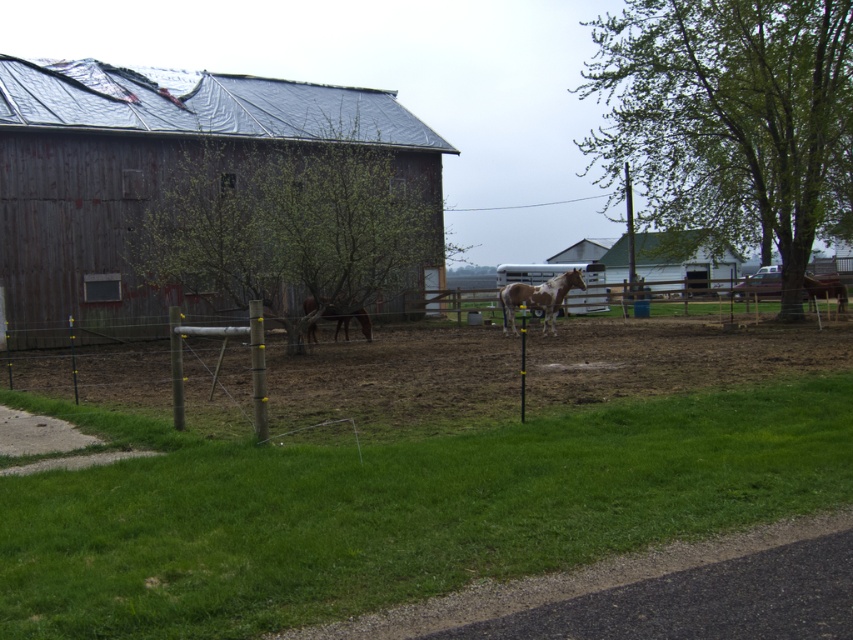
Question: Considering the real-world distances, which object is farthest from the green leafy tree at center?

Choices:
 (A) white wooden barn at center
 (B) rusty wood barn at left

Answer: (B)

Question: From the image, what is the correct spatial relationship of wooden fence at center in relation to brown glossy horse at center?

Choices:
 (A) above
 (B) below

Answer: (A)

Question: Is green grass at lower center above rusty wood barn at left?

Choices:
 (A) yes
 (B) no

Answer: (B)

Question: Which of the following is the closest to the observer?

Choices:
 (A) green grass at lower center
 (B) speckled brown horse at center
 (C) rusty wood barn at left
 (D) brown glossy horse at center

Answer: (A)

Question: Is speckled brown horse at center positioned in front of brown glossy horse at center?

Choices:
 (A) yes
 (B) no

Answer: (B)

Question: Which point appears closest to the camera in this image?

Choices:
 (A) (393, 472)
 (B) (323, 173)

Answer: (A)